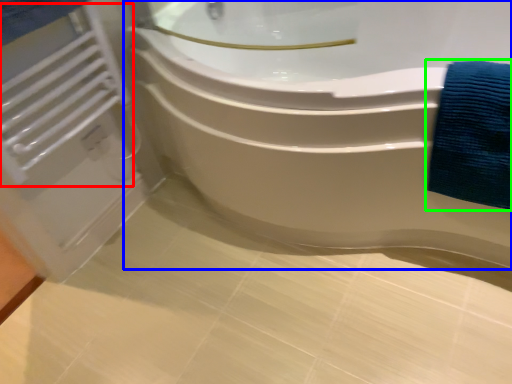
Question: Which is nearer to the radiator (highlighted by a red box)? bathtub (highlighted by a blue box) or bath towel (highlighted by a green box).

Choices:
 (A) bathtub
 (B) bath towel

Answer: (A)